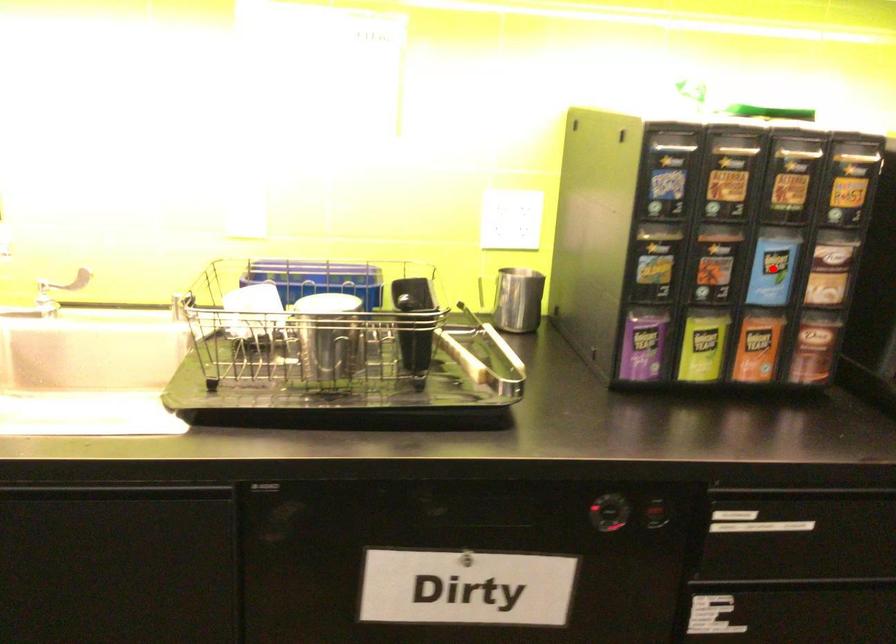
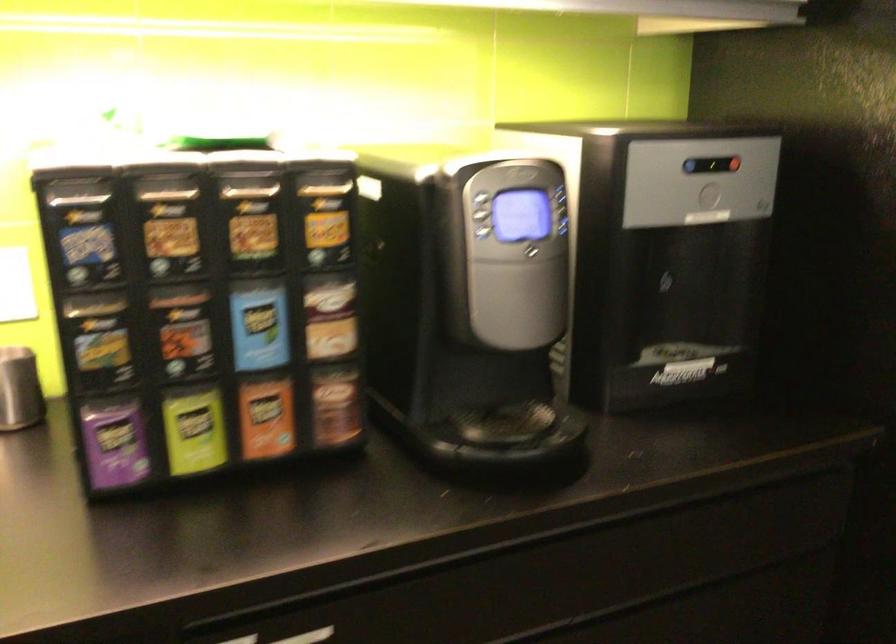
The point at the highlighted location is marked in the first image. Where is the corresponding point in the second image?

(259, 327)